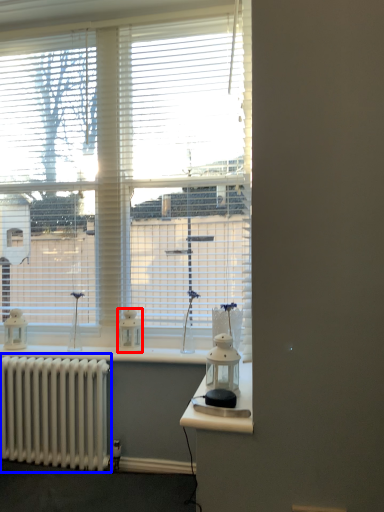
Question: Which point is closer to the camera, appliance (highlighted by a red box) or radiator (highlighted by a blue box)?

Choices:
 (A) appliance
 (B) radiator

Answer: (B)